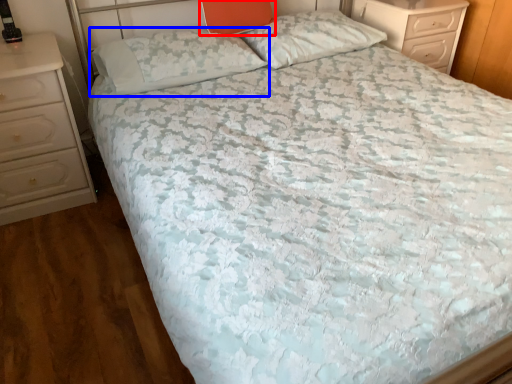
Question: Which object appears farthest to the camera in this image, pillow (highlighted by a red box) or pillow (highlighted by a blue box)?

Choices:
 (A) pillow
 (B) pillow

Answer: (A)